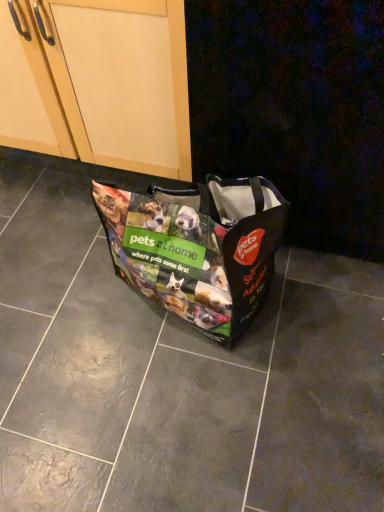
Locate an element on the screen. The image size is (384, 512). free space in front of polyester tote bag at center is located at coordinates (190, 418).